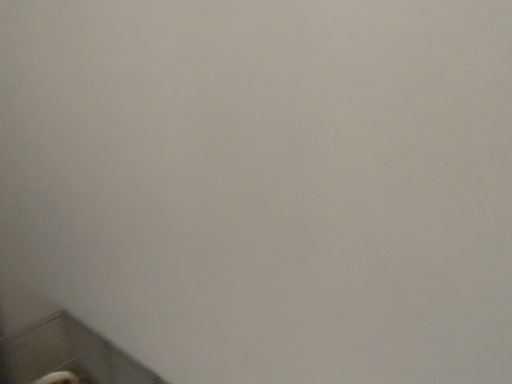
Locate an element on the screen. The image size is (512, 384). white matte toilet paper at lower left is located at coordinates (58, 378).

What is the approximate height of white matte toilet paper at lower left?

1.18 inches.

Image resolution: width=512 pixels, height=384 pixels. What do you see at coordinates (58, 378) in the screenshot?
I see `white matte toilet paper at lower left` at bounding box center [58, 378].

This screenshot has width=512, height=384. In order to click on white matte toilet paper at lower left in this screenshot , I will do `click(58, 378)`.